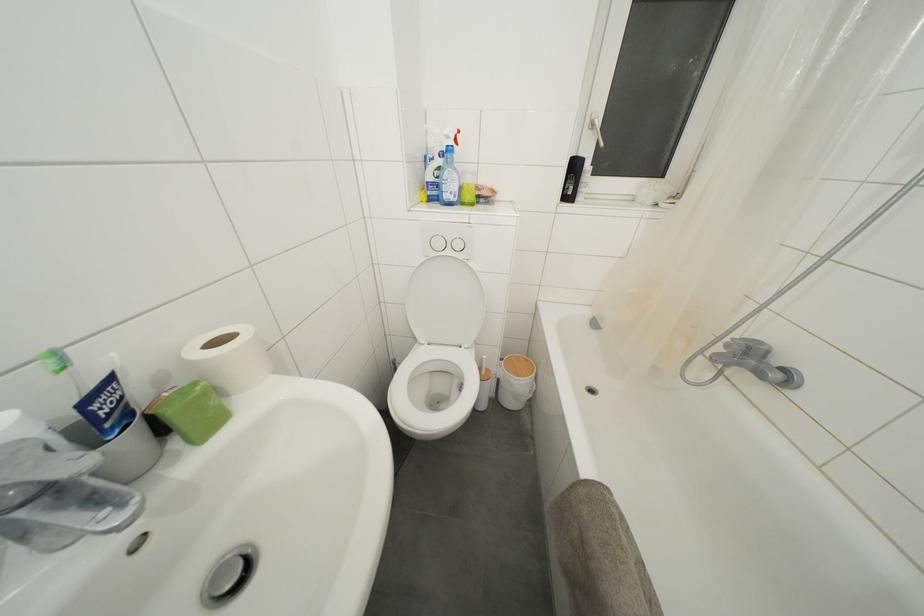
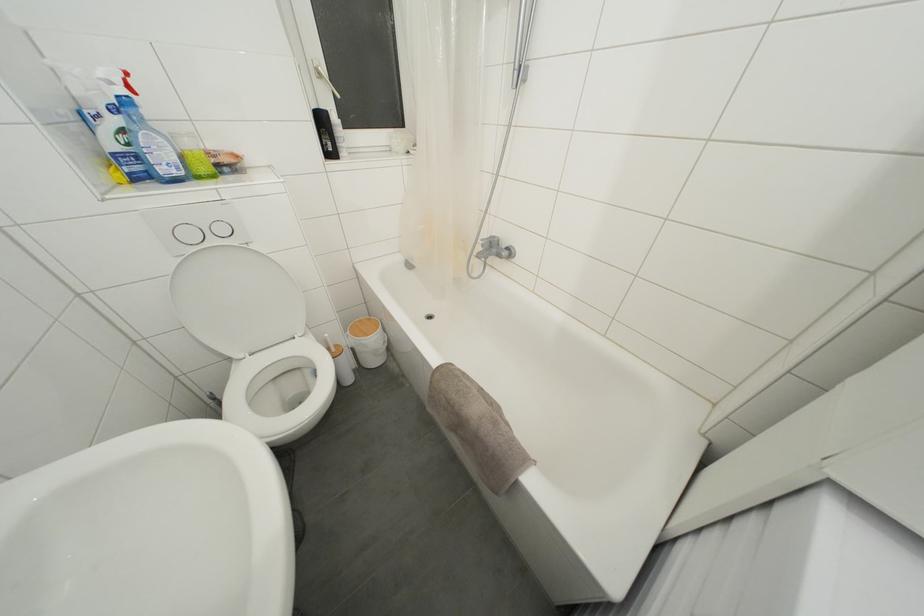
Find the pixel in the second image that matches point (463, 251) in the first image.

(226, 235)